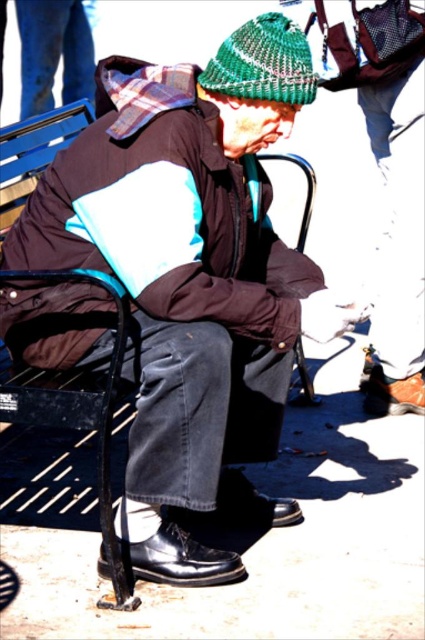
Can you confirm if brown matte jacket at center is positioned to the right of green knitted hat at upper center?

In fact, brown matte jacket at center is to the left of green knitted hat at upper center.

The width and height of the screenshot is (425, 640). What do you see at coordinates (164, 211) in the screenshot? I see `brown matte jacket at center` at bounding box center [164, 211].

Is point (175, 157) closer to viewer compared to point (277, 20)?

Yes, point (175, 157) is closer to viewer.

Where is `brown matte jacket at center`? brown matte jacket at center is located at coordinates (164, 211).